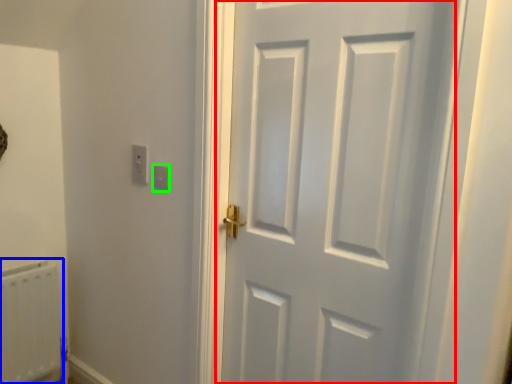
Question: Which object is the farthest from door (highlighted by a red box)? Choose among these: radiator (highlighted by a blue box) or light switch (highlighted by a green box).

Choices:
 (A) radiator
 (B) light switch

Answer: (A)